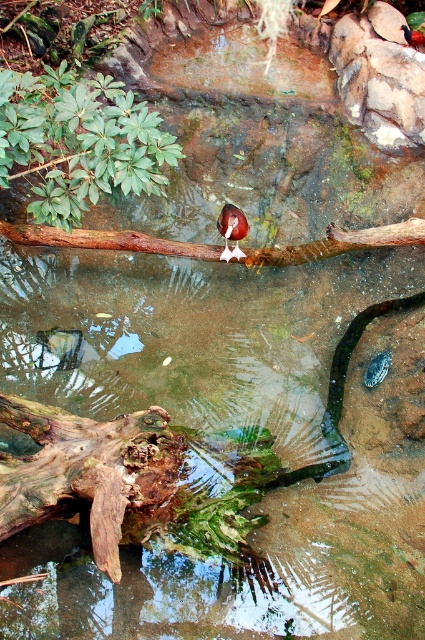
You are standing at the center of the pond and want to locate the green leafy plant at upper left. In which direction should you look to see it?

The green leafy plant at upper left is located at point 0.222 on the x axis and 0.186 on the y axis. Since the coordinates are both less than 0.5, it is positioned to the upper left from your current position at the center of the pond.